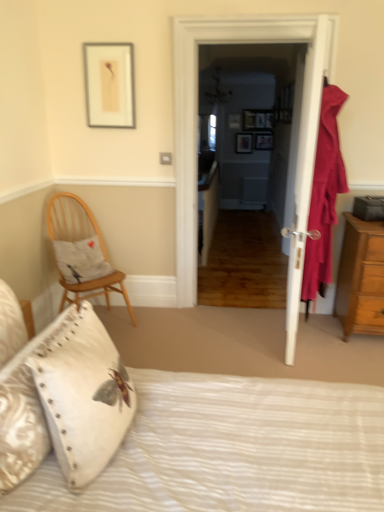
Question: Is wooden picture frame at center, positioned as the fourth picture frame in front-to-back order, outside velvet red curtain at right?

Choices:
 (A) no
 (B) yes

Answer: (B)

Question: Does wooden picture frame at center, which is the 4th picture frame from top to bottom, have a lesser width compared to velvet red curtain at right?

Choices:
 (A) no
 (B) yes

Answer: (B)

Question: Can you confirm if wooden picture frame at center, the 1th picture frame positioned from the right, is wider than velvet red curtain at right?

Choices:
 (A) no
 (B) yes

Answer: (A)

Question: Is wooden picture frame at center, which is the 4th picture frame from top to bottom, touching velvet red curtain at right?

Choices:
 (A) no
 (B) yes

Answer: (A)

Question: Is wooden picture frame at center, positioned as the fourth picture frame in front-to-back order, closer to the viewer compared to velvet red curtain at right?

Choices:
 (A) yes
 (B) no

Answer: (B)

Question: Do you think white wooden door at center is within white textured bed at lower center, or outside of it?

Choices:
 (A) outside
 (B) inside

Answer: (A)

Question: Would you say white wooden door at center is to the left or to the right of white textured bed at lower center in the picture?

Choices:
 (A) left
 (B) right

Answer: (B)

Question: From a real-world perspective, is white wooden door at center physically located above or below white textured bed at lower center?

Choices:
 (A) above
 (B) below

Answer: (A)

Question: Is point (178, 267) closer or farther from the camera than point (3, 322)?

Choices:
 (A) farther
 (B) closer

Answer: (A)

Question: In the image, is white textured bed at lower center positioned in front of or behind brown wooden chest of drawers at right?

Choices:
 (A) front
 (B) behind

Answer: (A)

Question: Looking at their shapes, would you say white textured bed at lower center is wider or thinner than brown wooden chest of drawers at right?

Choices:
 (A) wide
 (B) thin

Answer: (A)

Question: From a real-world perspective, is white textured bed at lower center positioned above or below brown wooden chest of drawers at right?

Choices:
 (A) above
 (B) below

Answer: (A)

Question: Is white textured bed at lower center taller or shorter than brown wooden chest of drawers at right?

Choices:
 (A) short
 (B) tall

Answer: (B)

Question: Is point (99, 276) positioned closer to the camera than point (331, 111)?

Choices:
 (A) closer
 (B) farther

Answer: (B)

Question: Choose the correct answer: Is wooden chair with cushion at left inside velvet red curtain at right or outside it?

Choices:
 (A) inside
 (B) outside

Answer: (B)